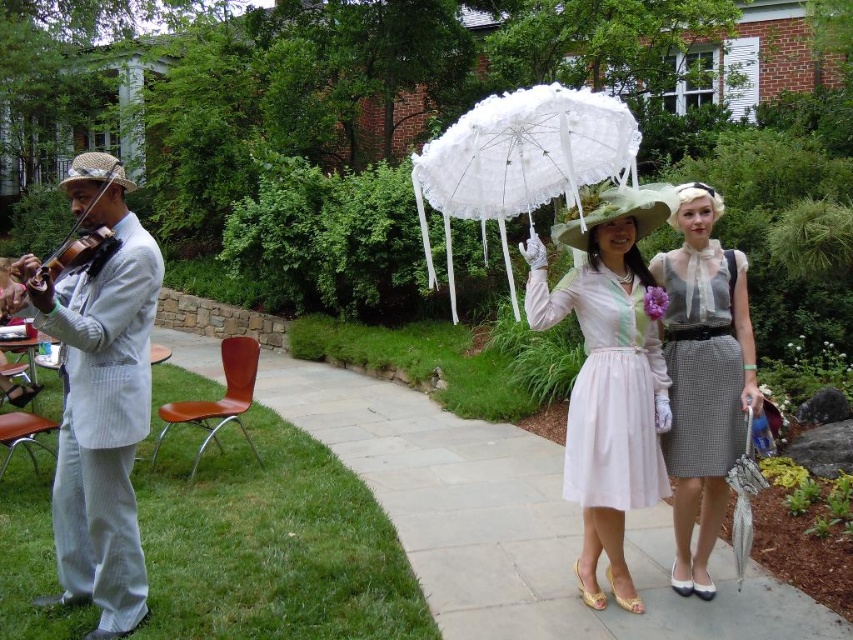
You are standing in the garden scene and want to place a small decorative rock. You have two points marked as point coordinates. Which point is better to place the rock so it appears closer to you? Please choose between point [606,296] and point [602,132].

Point [606,296] is closer to the viewer than point [602,132], so placing the rock there would make it appear closer.

You are a photographer setting up for a photoshoot in the garden. You need to position a matte white dress at center and a matte brown violin at left so that the dress is visible in the foreground while the violin is in the background. Based on the scene description, is this arrangement possible?

The matte white dress at center is located below the matte brown violin at left, meaning the dress is in front of the violin. Therefore, the arrangement is possible as the dress will be in the foreground and the violin in the background.